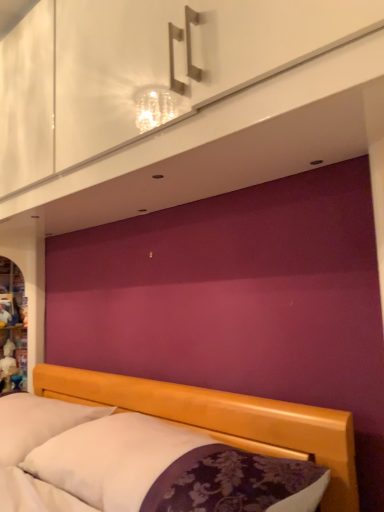
This screenshot has width=384, height=512. Describe the element at coordinates (224, 420) in the screenshot. I see `wooden bed at lower center` at that location.

The height and width of the screenshot is (512, 384). I want to click on white soft pillow at lower left, so click(37, 422).

Is the position of matte white cabinet at left less distant than that of wooden bed at lower center?

No, it is not.

From a real-world perspective, who is located higher, matte white cabinet at left or wooden bed at lower center?

matte white cabinet at left is physically above.

Is point (6, 305) behind point (43, 368)?

Yes.

Locate an element on the screen. The height and width of the screenshot is (512, 384). bed below the matte white cabinet at left (from a real-world perspective) is located at coordinates (224, 420).

Which object is closer to the camera taking this photo, white soft pillow at lower left or matte white cabinet at left?

Positioned in front is white soft pillow at lower left.

Find the location of a particular element. cabinetry behind the white soft pillow at lower left is located at coordinates (12, 328).

Is white soft pillow at lower left looking in the opposite direction of matte white cabinet at left?

That's not correct — white soft pillow at lower left is not looking away from matte white cabinet at left.

Is point (101, 409) farther from camera compared to point (20, 301)?

No.

From the picture: Is white glossy dresser at upper center to the left or to the right of white soft pillow at lower left in the image?

Clearly, white glossy dresser at upper center is on the right of white soft pillow at lower left in the image.

How many degrees apart are the facing directions of white glossy dresser at upper center and white soft pillow at lower left?

0.271 degrees.

Does white glossy dresser at upper center have a lesser width compared to white soft pillow at lower left?

Yes, white glossy dresser at upper center is thinner than white soft pillow at lower left.

From the image's perspective, is white glossy dresser at upper center above or below wooden bed at lower center?

Clearly, from the image's perspective, white glossy dresser at upper center is above wooden bed at lower center.

How many degrees apart are the facing directions of white glossy dresser at upper center and wooden bed at lower center?

0.626 degrees separate the facing orientations of white glossy dresser at upper center and wooden bed at lower center.

Could you tell me if white glossy dresser at upper center is facing wooden bed at lower center?

No, white glossy dresser at upper center does not turn towards wooden bed at lower center.

From the image's perspective, between wooden bed at lower center and white glossy dresser at upper center, who is located below?

wooden bed at lower center.

Which object is closer to the camera taking this photo, wooden bed at lower center or white glossy dresser at upper center?

wooden bed at lower center.

From a real-world perspective, is wooden bed at lower center above or below white glossy dresser at upper center?

Clearly, from a real-world perspective, wooden bed at lower center is below white glossy dresser at upper center.

Looking at the image, does wooden bed at lower center seem bigger or smaller compared to white glossy dresser at upper center?

wooden bed at lower center is bigger than white glossy dresser at upper center.

This screenshot has height=512, width=384. I want to click on pillow on the right of matte white cabinet at left, so click(x=37, y=422).

Is matte white cabinet at left completely or partially outside of white soft pillow at lower left?

Absolutely, matte white cabinet at left is external to white soft pillow at lower left.

Is matte white cabinet at left wider than white soft pillow at lower left?

No.

Could you tell me if matte white cabinet at left is turned towards white soft pillow at lower left?

No, matte white cabinet at left is not oriented towards white soft pillow at lower left.

Can you confirm if white soft pillow at lower left is shorter than wooden bed at lower center?

No.

Who is smaller, white soft pillow at lower left or wooden bed at lower center?

Smaller between the two is wooden bed at lower center.

Is wooden bed at lower center a part of white soft pillow at lower left?

No.

From the image's perspective, is white soft pillow at lower left below wooden bed at lower center?

Correct, white soft pillow at lower left appears lower than wooden bed at lower center in the image.

The height and width of the screenshot is (512, 384). I want to click on bed on the right of matte white cabinet at left, so click(x=224, y=420).

At what (x,y) coordinates should I click in order to perform the action: click on pillow located underneath the matte white cabinet at left (from a real-world perspective). Please return your answer as a coordinate pair (x, y). Image resolution: width=384 pixels, height=512 pixels. Looking at the image, I should click on 37,422.

Based on their spatial positions, is matte white cabinet at left or white glossy dresser at upper center closer to wooden bed at lower center?

matte white cabinet at left is positioned closer to the anchor wooden bed at lower center.

From the image, which object appears to be farther from matte white cabinet at left, wooden bed at lower center or white soft pillow at lower left?

The object further to matte white cabinet at left is white soft pillow at lower left.

Considering their positions, is white soft pillow at lower left positioned closer to matte white cabinet at left than white glossy dresser at upper center?

white soft pillow at lower left.

When comparing their distances from white soft pillow at lower left, does matte white cabinet at left or wooden bed at lower center seem further?

matte white cabinet at left.

When comparing their distances from wooden bed at lower center, does white soft pillow at lower left or white glossy dresser at upper center seem further?

Based on the image, white glossy dresser at upper center appears to be further to wooden bed at lower center.

Which object lies nearer to the anchor point white soft pillow at lower left, matte white cabinet at left or white glossy dresser at upper center?

matte white cabinet at left.

From the picture: Looking at the image, which one is located closer to white glossy dresser at upper center, matte white cabinet at left or wooden bed at lower center?

Among the two, wooden bed at lower center is located nearer to white glossy dresser at upper center.

Which object lies nearer to the anchor point matte white cabinet at left, white glossy dresser at upper center or wooden bed at lower center?

Among the two, wooden bed at lower center is located nearer to matte white cabinet at left.

Where is `bed between white glossy dresser at upper center and white soft pillow at lower left from top to bottom`? Image resolution: width=384 pixels, height=512 pixels. bed between white glossy dresser at upper center and white soft pillow at lower left from top to bottom is located at coordinates (224, 420).

At what (x,y) coordinates should I click in order to perform the action: click on pillow between white glossy dresser at upper center and matte white cabinet at left along the z-axis. Please return your answer as a coordinate pair (x, y). This screenshot has height=512, width=384. Looking at the image, I should click on pos(37,422).

The width and height of the screenshot is (384, 512). I want to click on dresser between wooden bed at lower center and matte white cabinet at left from front to back, so click(x=169, y=78).

Where is `pillow between wooden bed at lower center and matte white cabinet at left along the z-axis`? The width and height of the screenshot is (384, 512). pillow between wooden bed at lower center and matte white cabinet at left along the z-axis is located at coordinates (37, 422).